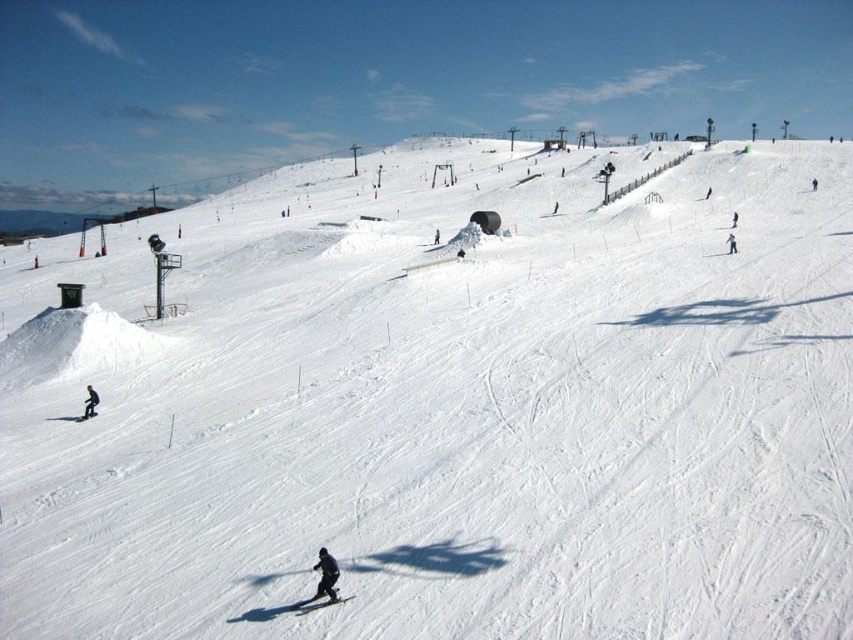
Question: Does dark blue snowboarder at center appear on the left side of black matte snowboarder at lower left?

Choices:
 (A) no
 (B) yes

Answer: (A)

Question: Which of these objects is positioned closest to the black matte snowboarder at lower left?

Choices:
 (A) black snowsuit at center-right
 (B) black matte snowboarder at center
 (C) black matte ski at lower center
 (D) dark blue snowboarder at center

Answer: (D)

Question: Which of the following is the farthest from the observer?

Choices:
 (A) black matte ski at lower center
 (B) dark blue snowboarder at center
 (C) black matte snowboarder at lower left
 (D) black matte snowboarder at center

Answer: (C)

Question: Which object is the farthest from the black matte snowboarder at lower left?

Choices:
 (A) black matte ski at lower center
 (B) black matte snowboarder at center
 (C) black snowsuit at center-right
 (D) dark blue snowboarder at center

Answer: (C)

Question: From the image, what is the correct spatial relationship of dark blue snowboarder at center in relation to black matte snowboarder at lower left?

Choices:
 (A) left
 (B) right

Answer: (B)

Question: Is black matte snowboarder at lower left above black snowsuit at center-right?

Choices:
 (A) yes
 (B) no

Answer: (B)